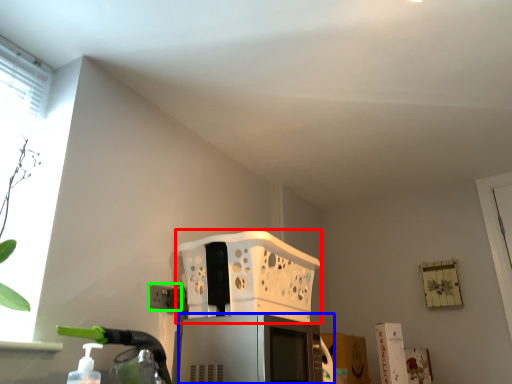
Question: Which object is the farthest from basket (highlighted by a red box)? Choose among these: appliance (highlighted by a blue box) or electric outlet (highlighted by a green box).

Choices:
 (A) appliance
 (B) electric outlet

Answer: (B)